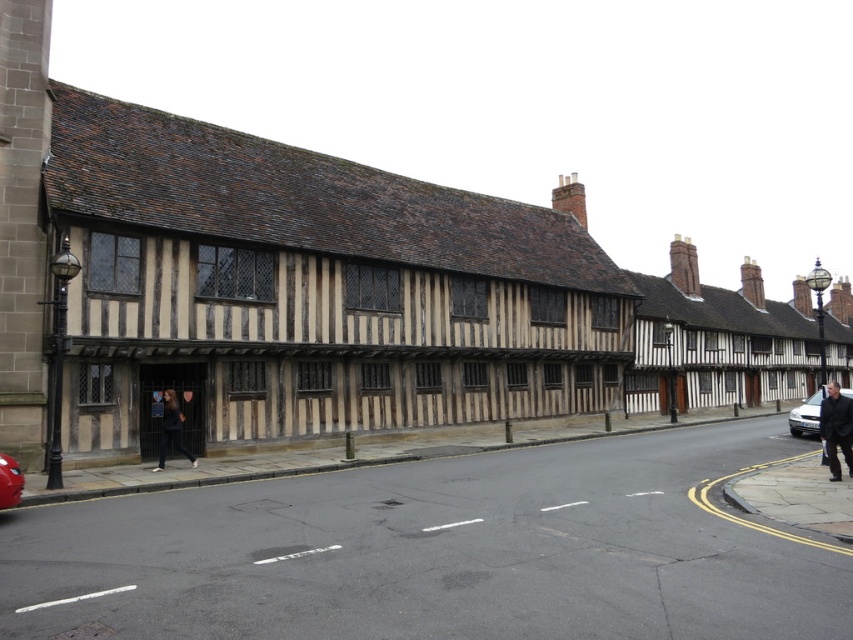
Which of these two, dark blue jeans at lower left or metallic red car at lower left, stands shorter?

With less height is metallic red car at lower left.

Find the location of a particular element. Image resolution: width=853 pixels, height=640 pixels. dark blue jeans at lower left is located at coordinates (171, 429).

Image resolution: width=853 pixels, height=640 pixels. I want to click on dark blue jeans at lower left, so (x=171, y=429).

Identify the location of dark blue jeans at lower left. (171, 429).

Is dark blue jeans at lower left positioned in front of silver metallic sedan at right?

No.

Does dark blue jeans at lower left have a lesser height compared to silver metallic sedan at right?

Correct, dark blue jeans at lower left is not as tall as silver metallic sedan at right.

Locate an element on the screen. The image size is (853, 640). dark blue jeans at lower left is located at coordinates pyautogui.click(x=171, y=429).

Who is shorter, black fabric coat at lower right or dark blue jeans at lower left?

Standing shorter between the two is dark blue jeans at lower left.

Based on the photo, can you confirm if black fabric coat at lower right is positioned below dark blue jeans at lower left?

No.

This screenshot has width=853, height=640. What do you see at coordinates (836, 428) in the screenshot?
I see `black fabric coat at lower right` at bounding box center [836, 428].

This screenshot has width=853, height=640. In order to click on black fabric coat at lower right in this screenshot , I will do `click(836, 428)`.